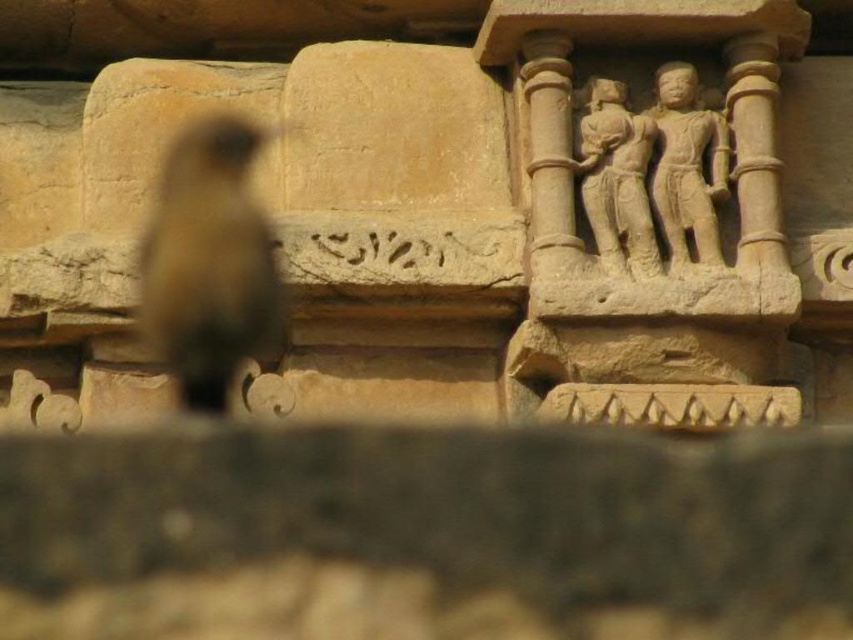
Question: Is beige stone carving at upper right above beige stone pillar at upper right?

Choices:
 (A) yes
 (B) no

Answer: (A)

Question: Does beige stone statue at upper right have a larger size compared to beige stone pillar at upper right?

Choices:
 (A) yes
 (B) no

Answer: (B)

Question: Does brown feathered bird at left appear on the right side of beige stone pillar at upper right?

Choices:
 (A) no
 (B) yes

Answer: (A)

Question: Which of the following is the closest to the observer?

Choices:
 (A) beige stone statue at upper right
 (B) brown feathered bird at left

Answer: (B)

Question: Among these objects, which one is nearest to the camera?

Choices:
 (A) brown feathered bird at left
 (B) beige stone pillar at upper right
 (C) beige stone statue at upper right
 (D) carved stone figures at upper right

Answer: (A)

Question: Which of the following is the closest to the observer?

Choices:
 (A) (509, 51)
 (B) (244, 180)

Answer: (B)